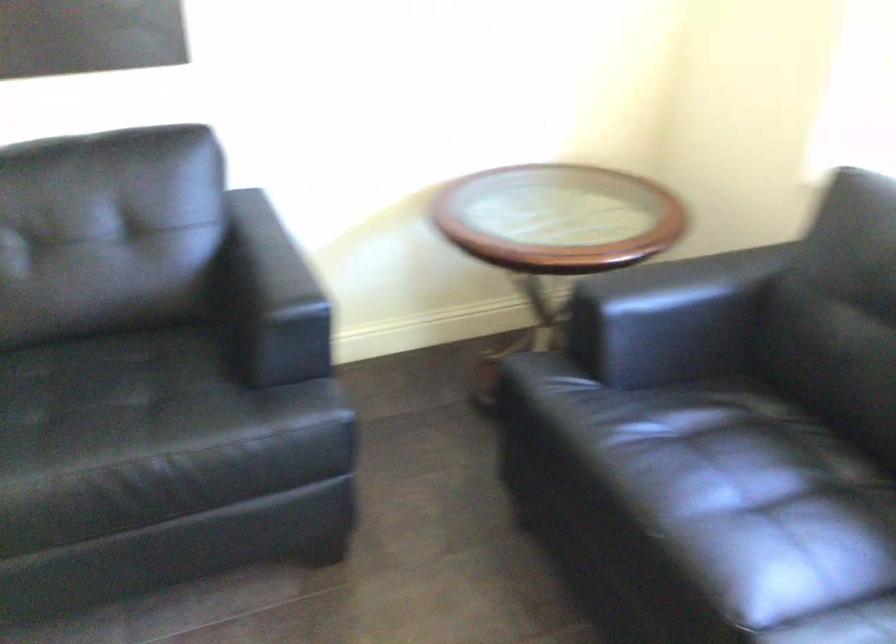
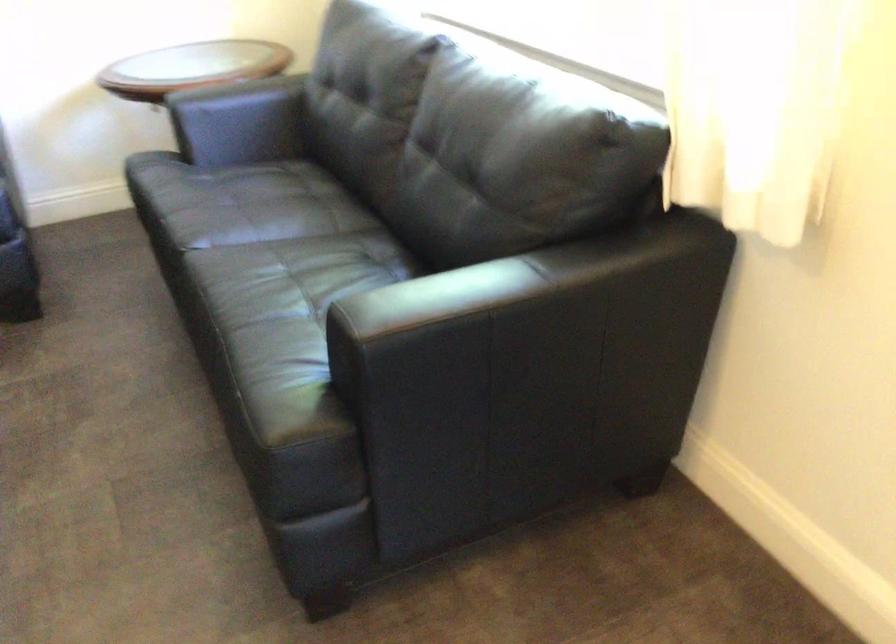
The images are taken continuously from a first-person perspective. In which direction are you moving?

The cameraman moved toward right, backward.